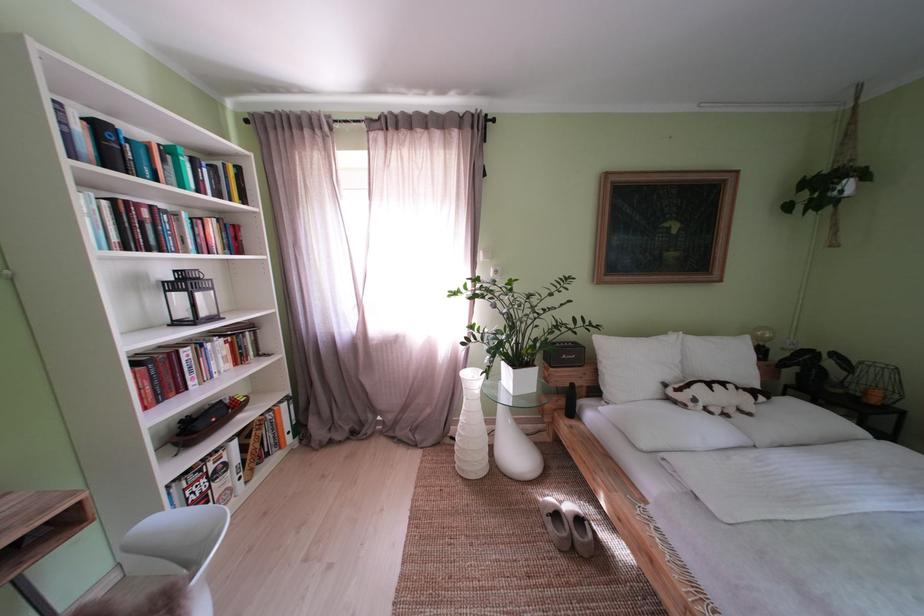
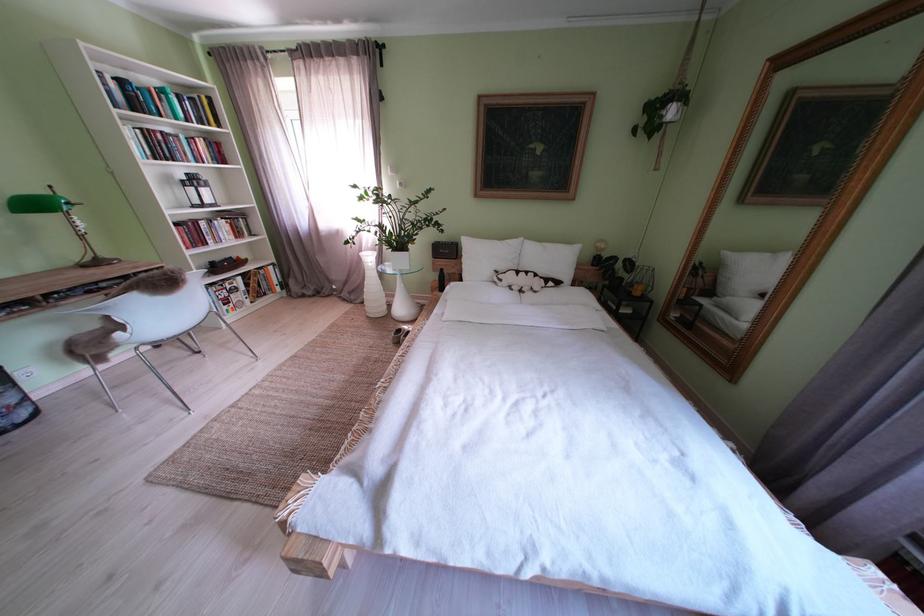
Locate, in the second image, the point that corresponds to point 429,443 in the first image.

(363, 302)